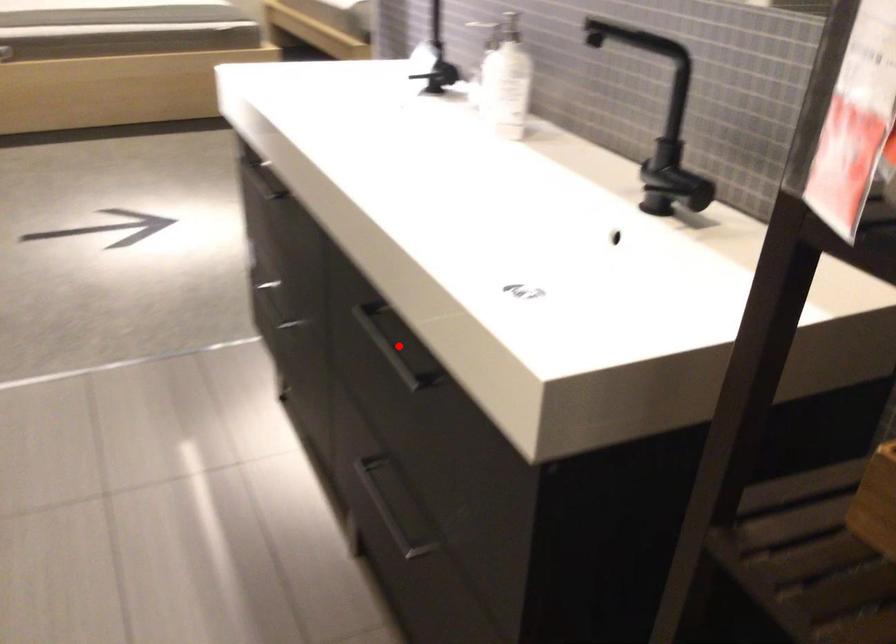
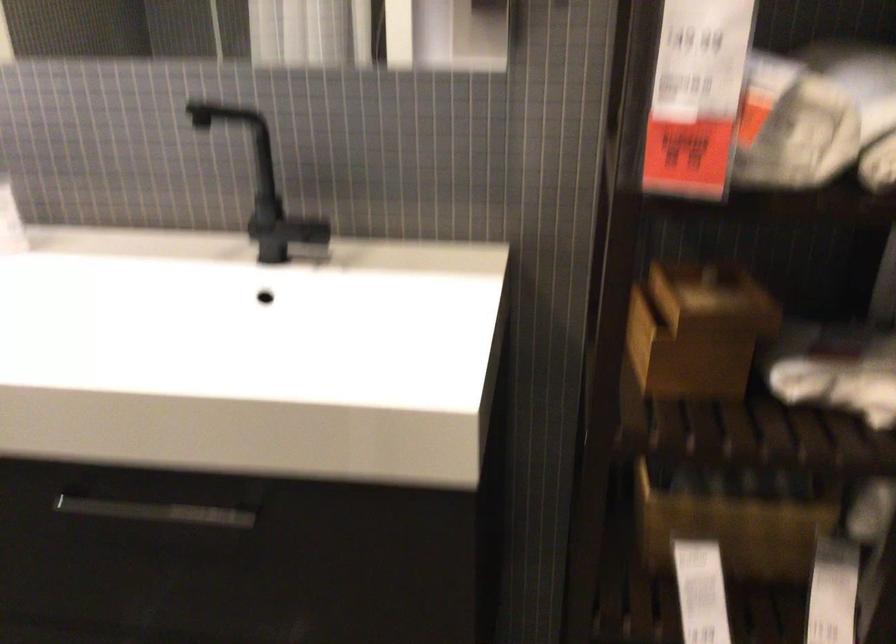
Question: I am providing you with two images of the same scene from different viewpoints. In image1, a red point is highlighted. Considering the same 3D point in image2, which of the following is correct?

Choices:
 (A) It is closer
 (B) It is farther

Answer: (A)